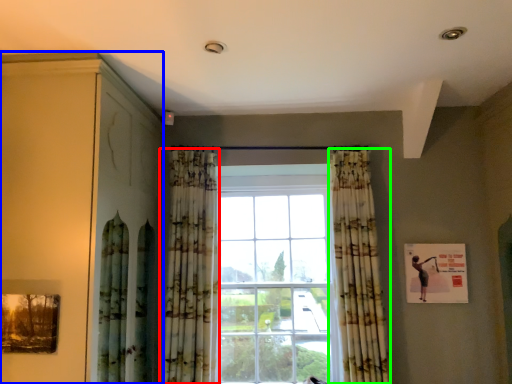
Question: Considering the real-world distances, which object is closest to curtain (highlighted by a red box)? dresser (highlighted by a blue box) or curtain (highlighted by a green box).

Choices:
 (A) dresser
 (B) curtain

Answer: (A)